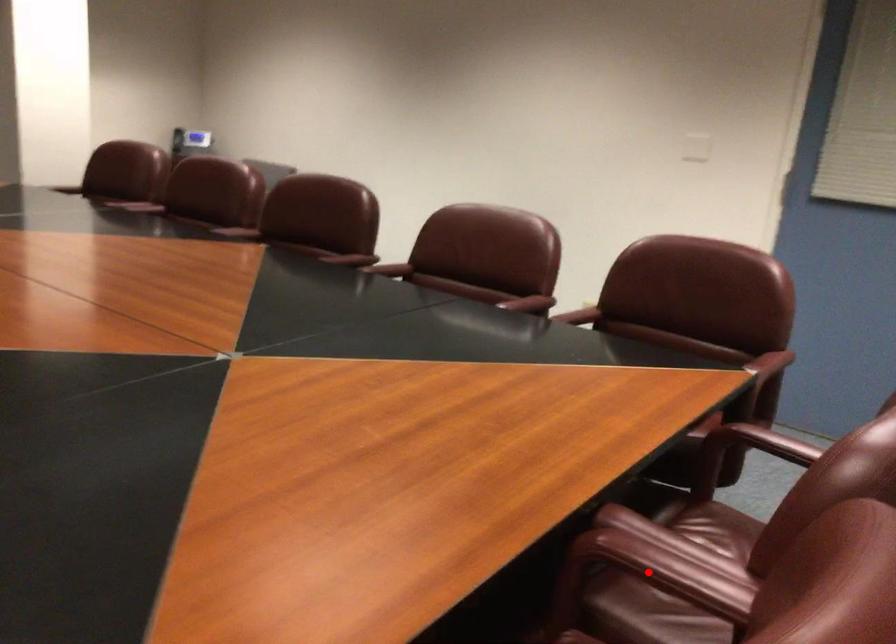
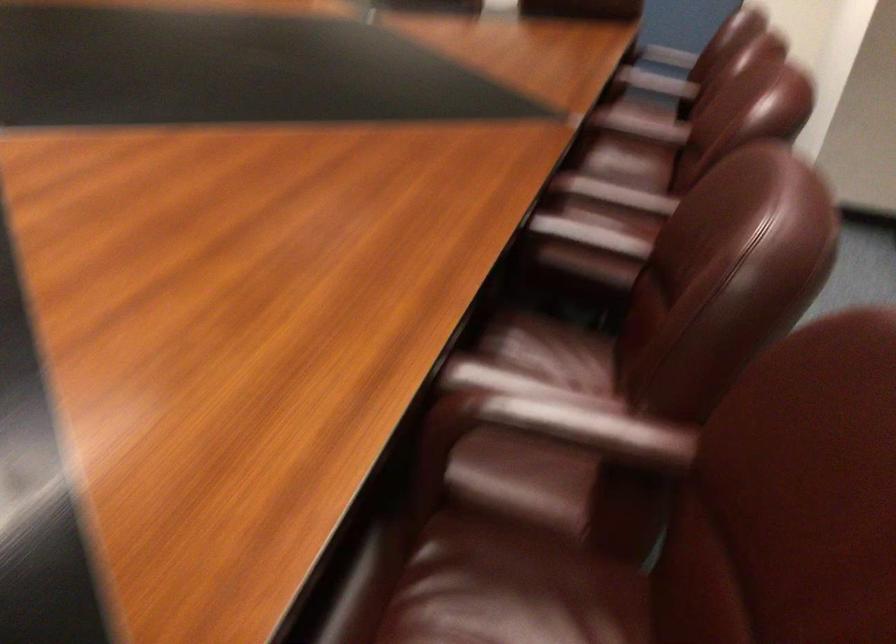
In the second image, find the point that corresponds to the highlighted location in the first image.

(656, 82)